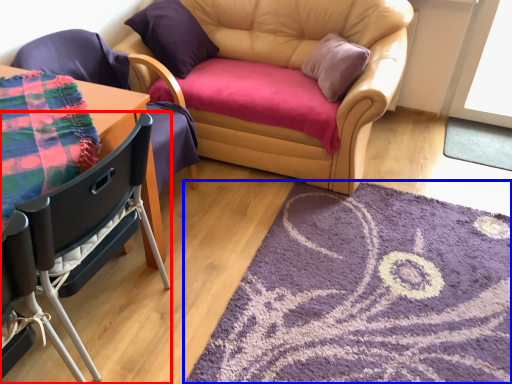
Question: Which point is closer to the camera, chair (highlighted by a red box) or mat (highlighted by a blue box)?

Choices:
 (A) chair
 (B) mat

Answer: (A)